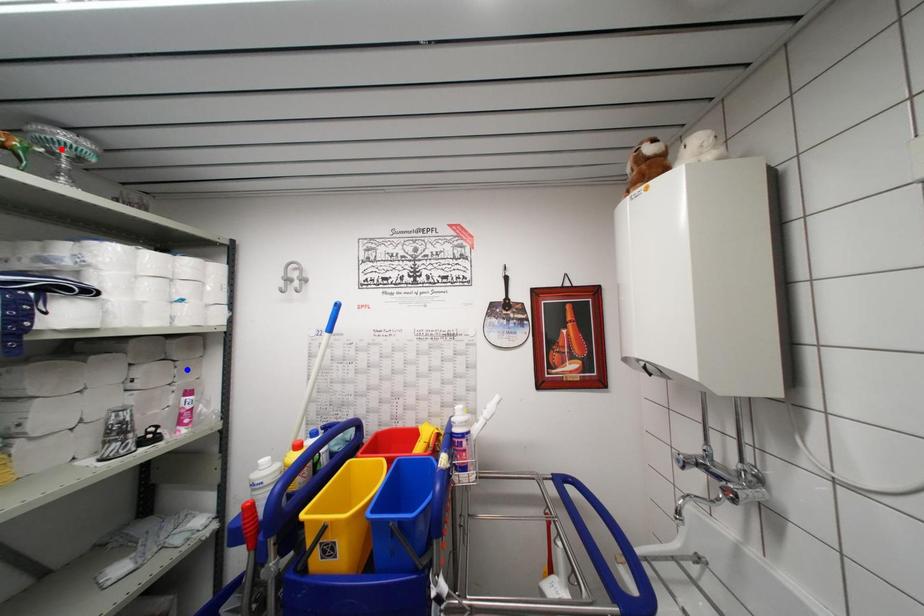
Question: Two points are marked on the image. Which point is closer to the camera?

Choices:
 (A) Blue point is closer.
 (B) Red point is closer.

Answer: (B)